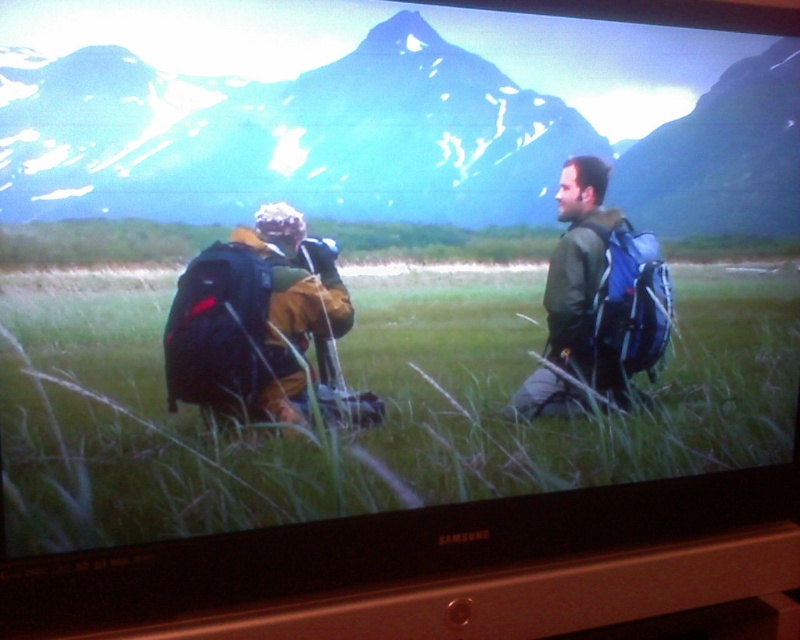
You are standing in the scene and want to move from the green grass at center to the green matte jacket at right. Which direction should you move in?

You should move to the right to go from the green grass at center to the green matte jacket at right since the green grass at center is to the left of the green matte jacket at right.